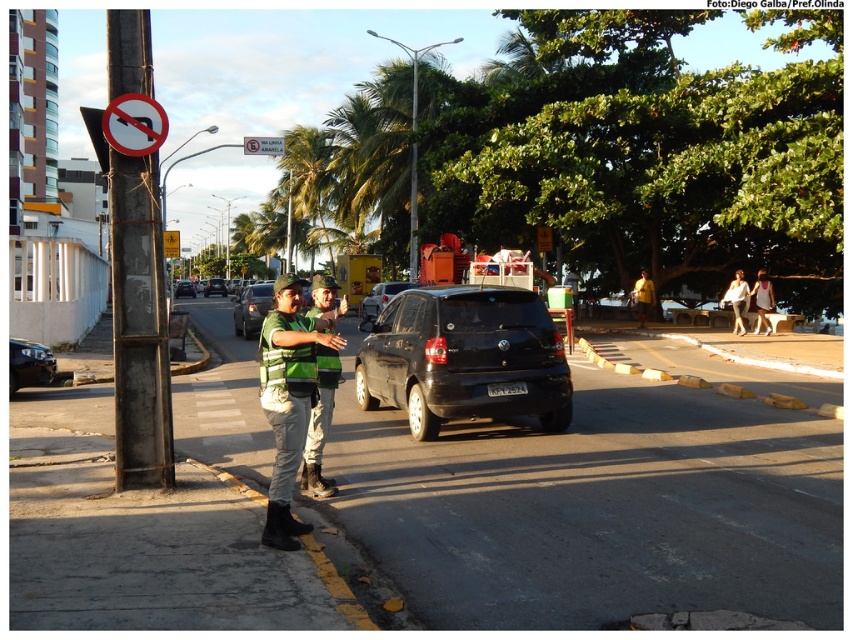
Question: Which of these objects is positioned closest to the yellow plastic sign at upper center?

Choices:
 (A) black glossy sedan at center
 (B) yellow matte shirt at center
 (C) white fabric dress at right
 (D) rusty metal pole at left

Answer: (D)

Question: Considering the real-world distances, which object is closest to the yellow plastic sign at upper center?

Choices:
 (A) black glossy car at center
 (B) green reflective vest at center
 (C) black matte suv at center

Answer: (C)

Question: Among these points, which one is farthest from the camera?

Choices:
 (A) pos(733,285)
 (B) pos(445,358)
 (C) pos(164,116)
 (D) pos(126,417)

Answer: (A)

Question: Is rusty metal pole at left closer to the viewer compared to white plastic sign at upper center?

Choices:
 (A) yes
 (B) no

Answer: (A)

Question: Can you confirm if green striped shirt at center is positioned to the right of yellow matte shirt at center?

Choices:
 (A) yes
 (B) no

Answer: (B)

Question: Can you confirm if green striped shirt at center is positioned above white plastic sign at upper center?

Choices:
 (A) no
 (B) yes

Answer: (A)